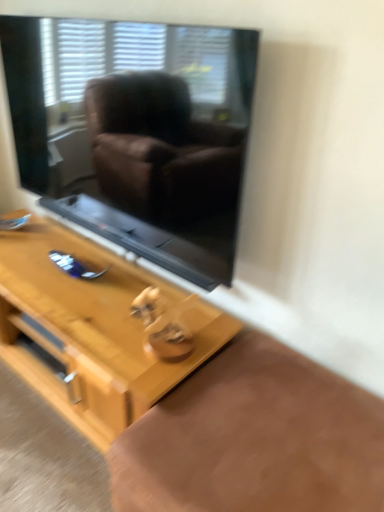
Image resolution: width=384 pixels, height=512 pixels. What are the coordinates of `free spot above black glass window screen at upper center (from a real-world perspective)` in the screenshot? It's located at (81, 5).